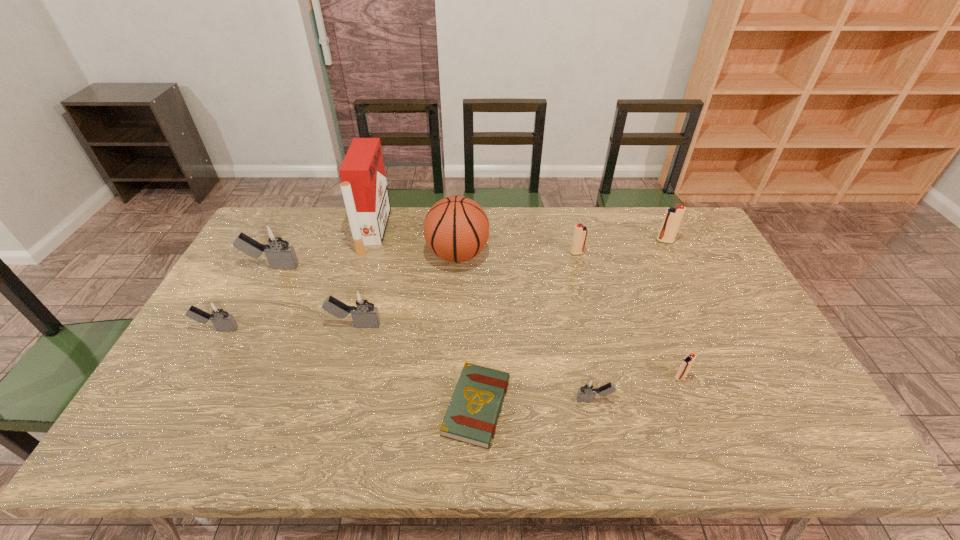
Image resolution: width=960 pixels, height=540 pixels. Identify the location of vacant space located 0.140m on the side where the inflation valve is located. (531, 255).

You are a GUI agent. You are given a task and a screenshot of the screen. Output one action in this format:
    pyautogui.click(x=<x>, y=<y>)
    Task: Click on the vacant space situated 0.290m on the right of the biggest gray igniter
    
    Given the screenshot: What is the action you would take?
    pyautogui.click(x=388, y=267)

At what (x,y) coordinates should I click in order to perform the action: click on vacant space situated on the back of the biggest red igniter. Please return your answer as a coordinate pair (x, y). The height and width of the screenshot is (540, 960). Looking at the image, I should click on (657, 225).

Where is `free space located 0.200m on the right of the third smallest gray igniter`? This screenshot has height=540, width=960. free space located 0.200m on the right of the third smallest gray igniter is located at coordinates (450, 325).

At what (x,y) coordinates should I click in order to perform the action: click on free space located on the back of the second smallest gray igniter. Please return your answer as a coordinate pair (x, y). The width and height of the screenshot is (960, 540). Looking at the image, I should click on (261, 252).

You are a GUI agent. You are given a task and a screenshot of the screen. Output one action in this format:
    pyautogui.click(x=<x>, y=<y>)
    Task: Click on the free space located on the right of the second smallest red igniter
    This screenshot has width=960, height=540.
    Given the screenshot: What is the action you would take?
    699,253

I want to click on free space located on the left of the second red igniter from right to left, so click(x=533, y=377).

What are the coordinates of `free space located on the back of the nearest gray igniter` in the screenshot? It's located at (569, 283).

Identify the location of vacant space located on the back of the book. (477, 322).

What are the coordinates of `cigarette case that is at the far edge` in the screenshot? It's located at (364, 187).